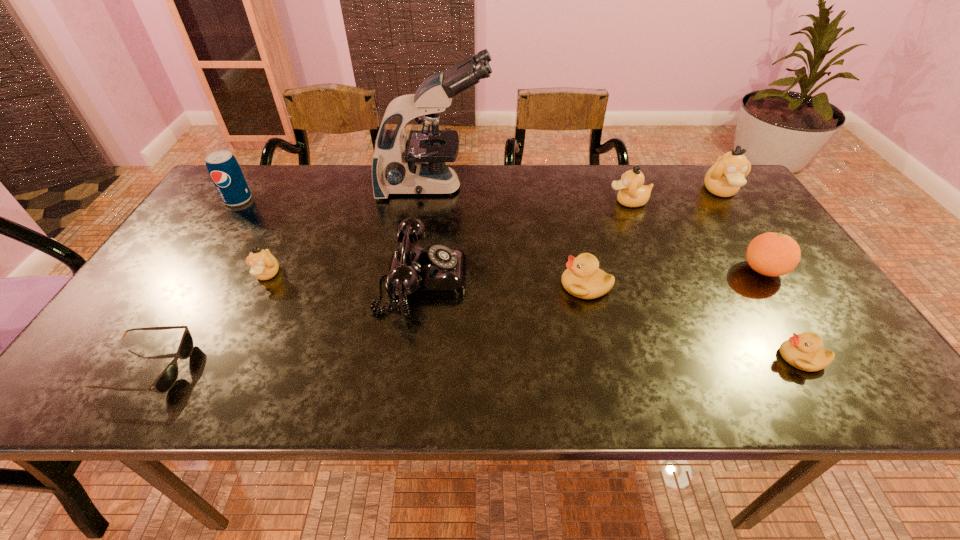
You are a GUI agent. You are given a task and a screenshot of the screen. Output one action in this format:
    pyautogui.click(x=<x>, y=<y>)
    Task: Click on the object that is positioned at the far right corner
    This screenshot has height=540, width=960.
    Given the screenshot: What is the action you would take?
    pyautogui.click(x=724, y=179)

Find the location of `object at the near right corner`. object at the near right corner is located at coordinates (804, 351).

Find the location of `vacant area at the far edge of the desktop`. vacant area at the far edge of the desktop is located at coordinates (684, 199).

This screenshot has height=540, width=960. What are the coordinates of `free space at the near edge of the desktop` in the screenshot? It's located at (323, 368).

In the image, there is a desktop. Where is `blank space at the left edge`? blank space at the left edge is located at coordinates (205, 254).

Image resolution: width=960 pixels, height=540 pixels. In the image, there is a desktop. What are the coordinates of `free space at the right edge` in the screenshot? It's located at (728, 236).

Image resolution: width=960 pixels, height=540 pixels. I want to click on vacant space at the far right corner, so click(x=734, y=201).

Find the location of a particular element. vacant area that lies between the leftmost duckling and the blue pop is located at coordinates (252, 237).

Find the location of a particular element. The height and width of the screenshot is (540, 960). blank region between the second tallest duckling and the orange orange is located at coordinates (695, 236).

Identify the location of vacant point located between the blue pop and the shortest object. Image resolution: width=960 pixels, height=540 pixels. (193, 284).